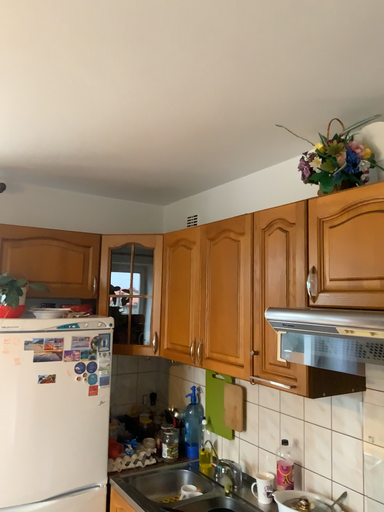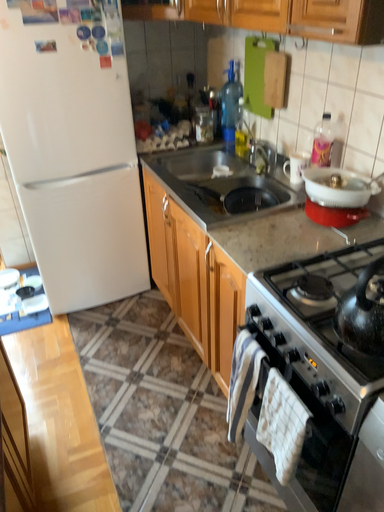
Question: Which way did the camera rotate in the video?

Choices:
 (A) rotated downward
 (B) rotated upward

Answer: (A)